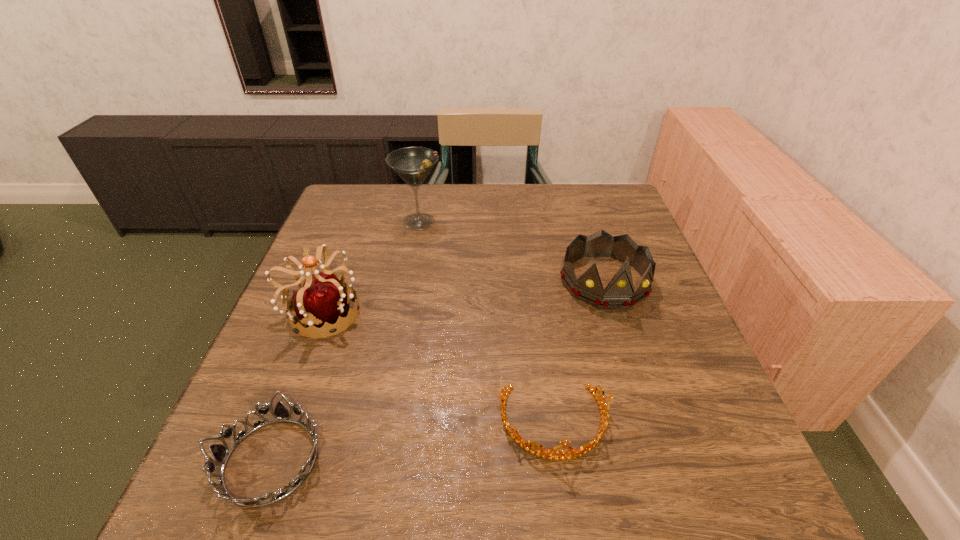
In order to click on the third object from right to left in this screenshot , I will do `click(413, 164)`.

In order to click on the tallest object in this screenshot , I will do `click(413, 164)`.

Where is `the second tallest object`? the second tallest object is located at coordinates (323, 299).

Identify the location of the third tallest object. This screenshot has width=960, height=540. (619, 293).

Locate an element on the screen. the third tallest tiara is located at coordinates (544, 453).

The width and height of the screenshot is (960, 540). Identify the location of the shortest tiara. (220, 453).

The image size is (960, 540). What are the coordinates of `vacant space situated 0.300m on the front of the farthest object` in the screenshot? It's located at (402, 314).

This screenshot has height=540, width=960. What are the coordinates of `vacant space located on the front-facing side of the tallest tiara` in the screenshot? It's located at (438, 313).

Locate an element on the screen. The height and width of the screenshot is (540, 960). vacant area situated 0.350m at the front of the third shortest tiara with jewels is located at coordinates (663, 465).

Identify the location of free space located 0.070m on the front-facing side of the second shortest tiara. (566, 512).